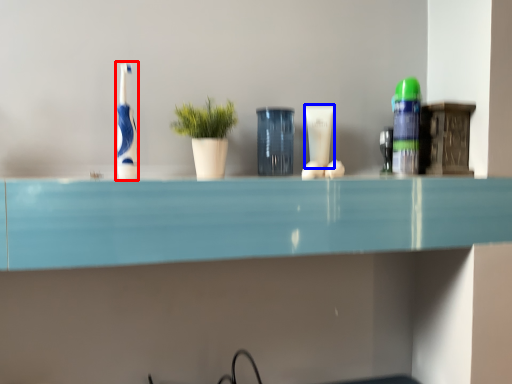
Question: Which object appears farthest to the camera in this image, toothbrush (highlighted by a red box) or toiletry (highlighted by a blue box)?

Choices:
 (A) toothbrush
 (B) toiletry

Answer: (B)